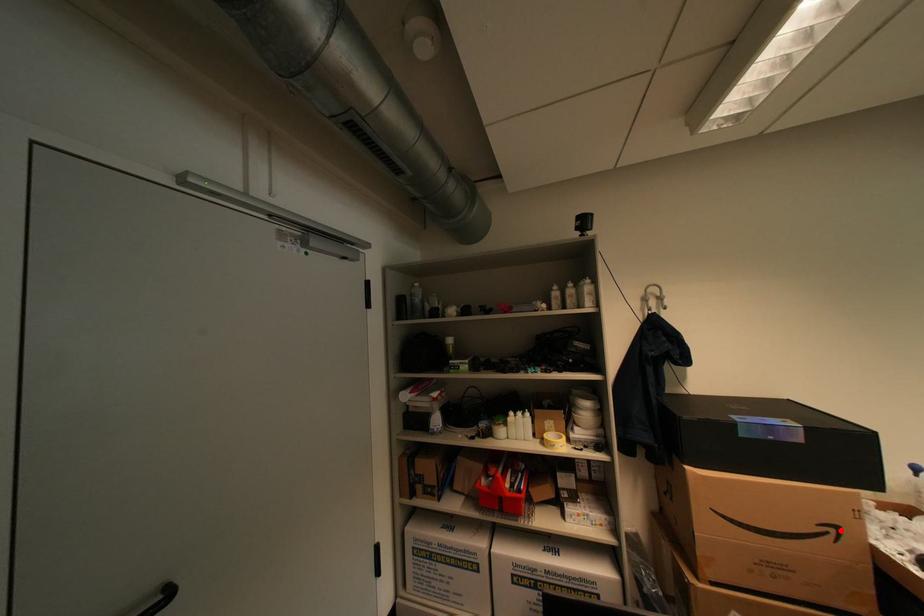
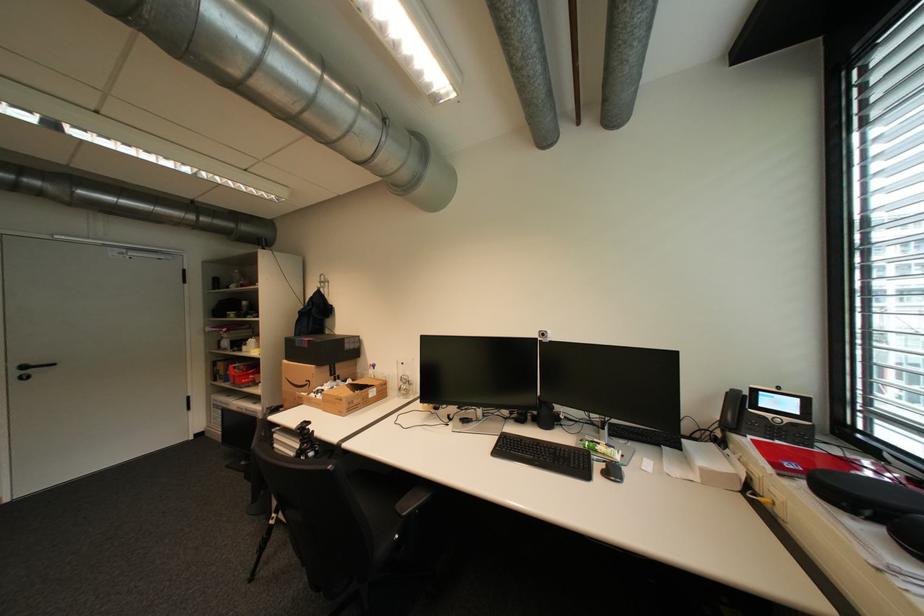
In the second image, find the point that corresponds to the highlighted location in the first image.

(317, 383)